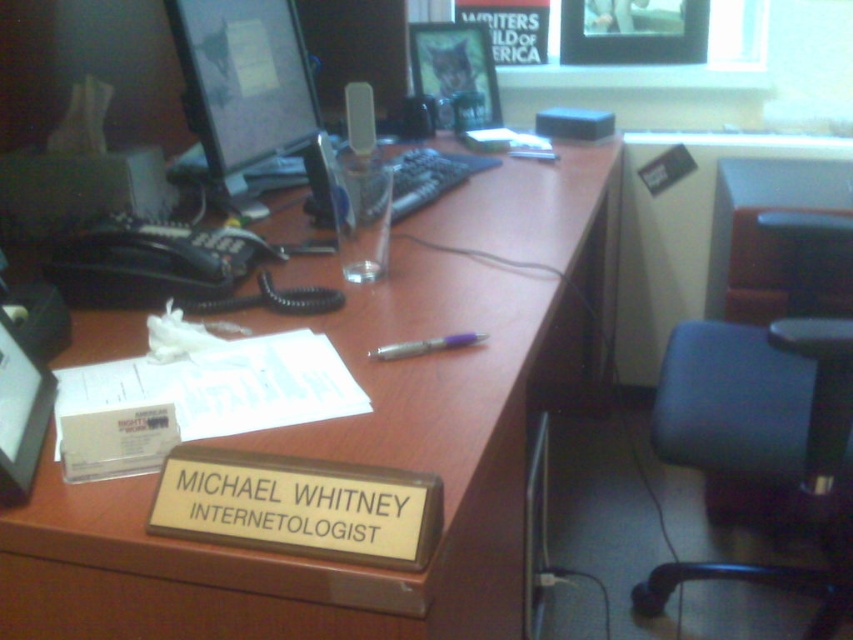
Question: Which object is farther from the camera taking this photo?

Choices:
 (A) brown wood drawer at lower center
 (B) brown wood desk at center
 (C) matte black monitor at upper left

Answer: (C)

Question: In this image, where is black leather swivel chair at right located relative to matte black monitor at upper left?

Choices:
 (A) below
 (B) above

Answer: (A)

Question: Which object is closer to the camera taking this photo?

Choices:
 (A) brown wood desk at center
 (B) brown wood drawer at lower center
 (C) black leather swivel chair at right
 (D) silver metallic pen at center

Answer: (A)

Question: Does brown wood desk at center lie behind black leather swivel chair at right?

Choices:
 (A) yes
 (B) no

Answer: (B)

Question: Which object is the closest to the matte black monitor at upper left?

Choices:
 (A) silver metallic pen at center
 (B) black leather swivel chair at right
 (C) brown wood drawer at lower center
 (D) brown wood desk at center

Answer: (D)

Question: Observing the image, what is the correct spatial positioning of brown wood drawer at lower center in reference to silver metallic pen at center?

Choices:
 (A) left
 (B) right

Answer: (A)